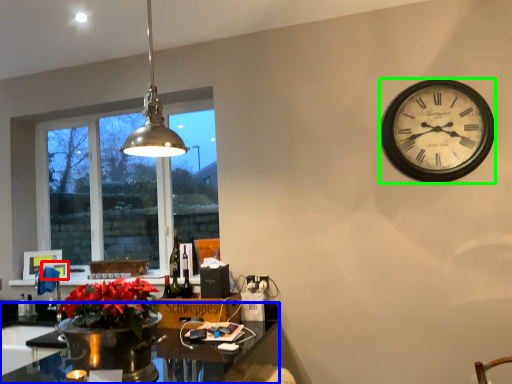
Question: Estimate the real-world distances between objects in this image. Which object is closer to picture frame (highlighted by a red box), desk (highlighted by a blue box) or wall clock (highlighted by a green box)?

Choices:
 (A) desk
 (B) wall clock

Answer: (A)